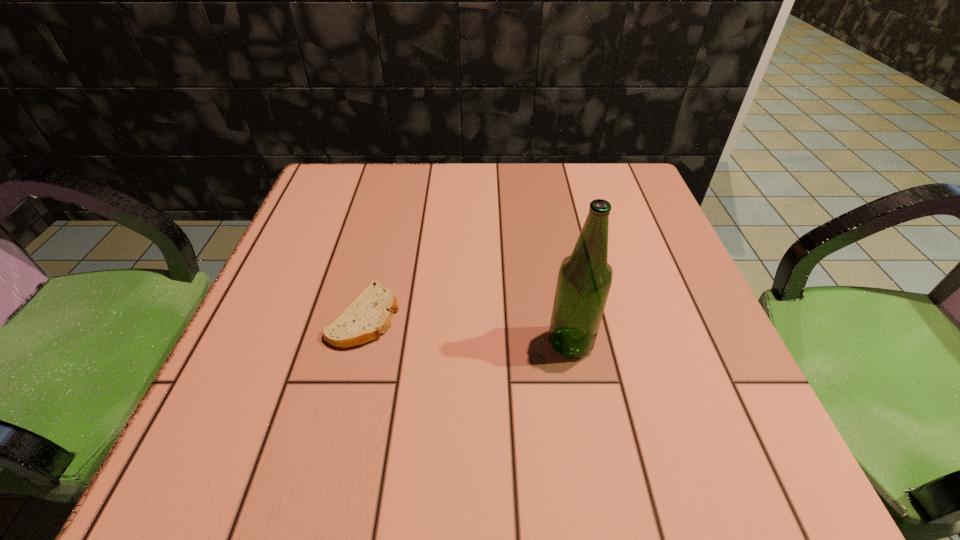
I want to click on the taller object, so click(x=584, y=279).

Where is `the right object`? The image size is (960, 540). the right object is located at coordinates (584, 279).

Where is `the left object`? The height and width of the screenshot is (540, 960). the left object is located at coordinates (370, 313).

Where is `pita bread`? The width and height of the screenshot is (960, 540). pita bread is located at coordinates (370, 313).

The image size is (960, 540). In order to click on free space located on the label of the right object in this screenshot , I will do tap(338, 343).

Where is `free location located on the label of the right object`? Image resolution: width=960 pixels, height=540 pixels. free location located on the label of the right object is located at coordinates (467, 343).

Locate an element on the screen. The width and height of the screenshot is (960, 540). vacant area situated 0.270m on the label of the right object is located at coordinates (380, 343).

At what (x,y) coordinates should I click in order to perform the action: click on vacant area situated on the back of the left object. Please return your answer as a coordinate pair (x, y). The image size is (960, 540). Looking at the image, I should click on (395, 195).

At what (x,y) coordinates should I click in order to perform the action: click on object that is at the left edge. Please return your answer as a coordinate pair (x, y). Looking at the image, I should click on (370, 313).

Where is `vacant space at the far edge of the desktop`? vacant space at the far edge of the desktop is located at coordinates (551, 208).